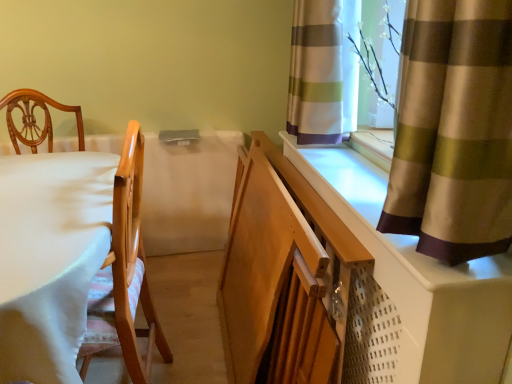
Locate an element on the screen. The width and height of the screenshot is (512, 384). empty space that is ontop of white plastic radiator at right (from a real-world perspective) is located at coordinates (351, 177).